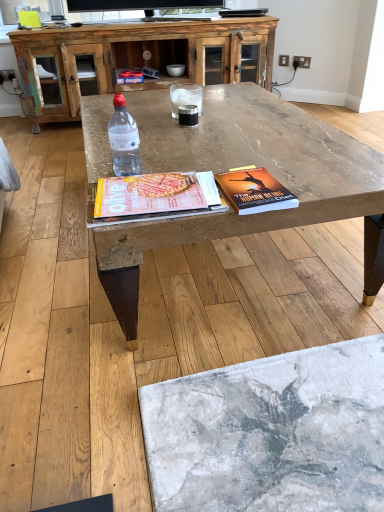
I want to click on vacant space behind transparent plastic bottle at center, so click(x=159, y=154).